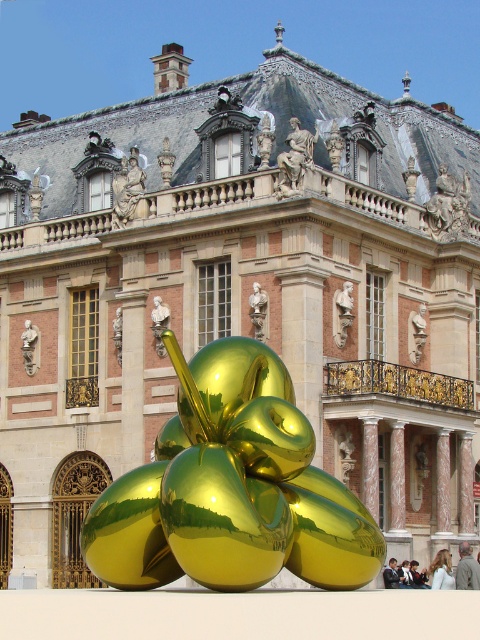
Question: Considering the real-world distances, which object is farthest from the polished stone statue at upper center?

Choices:
 (A) matte bronze statue at center
 (B) light brown hair at lower right

Answer: (B)

Question: Which object is positioned farthest from the polished bronze statue at upper right?

Choices:
 (A) light brown leather jacket at lower center
 (B) light brown leather jacket at lower right

Answer: (A)

Question: Can you confirm if polished bronze statue at upper right is bigger than polished stone statue at upper center?

Choices:
 (A) yes
 (B) no

Answer: (A)

Question: Which is nearer to the matte white bust at center?

Choices:
 (A) smooth black jacket at lower center
 (B) matte gray statue at center
 (C) gold reflective apples at center

Answer: (A)

Question: Does matte gold statue at upper center appear under light brown leather jacket at lower right?

Choices:
 (A) no
 (B) yes

Answer: (A)

Question: Does polished stone statue at upper center have a smaller size compared to smooth black jacket at lower center?

Choices:
 (A) no
 (B) yes

Answer: (B)